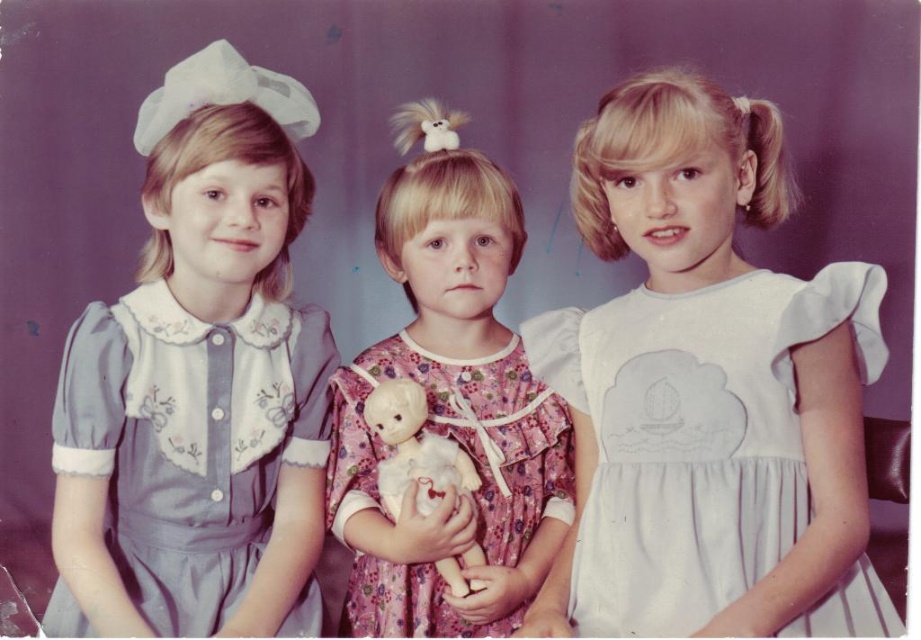
You are a photographer setting up for a photoshoot. You have two dresses in the scene, the white satin dress at center and the light blue cotton dress at left. Which dress is shorter in height?

The white satin dress at center is not as tall as the light blue cotton dress at left, so the white satin dress at center is shorter in height.

You are a photographer arranging a photo shoot. You have a white satin dress at center and a white plush doll at center. Which object should you move closer to the camera to make them appear the same size in the photo?

Since the white satin dress at center is bigger than the white plush doll at center, you should move the white plush doll at center closer to the camera to make them appear the same size in the photo.